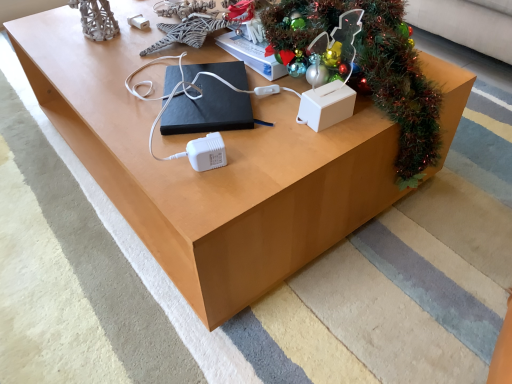
Identify the location of free region on the left part of black matte book at center. The width and height of the screenshot is (512, 384). (122, 97).